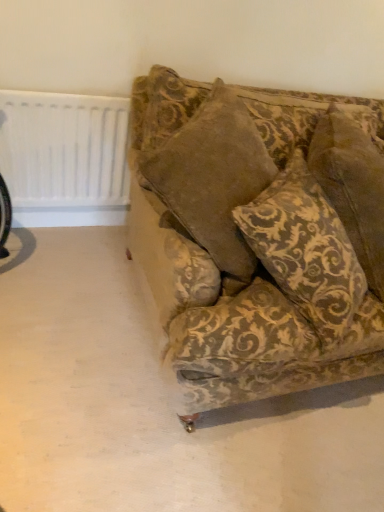
Where is `white plastic radiator at upper left`? Image resolution: width=384 pixels, height=512 pixels. white plastic radiator at upper left is located at coordinates (64, 149).

This screenshot has height=512, width=384. Find the location of `velvet gold-patterned pillow at center`. velvet gold-patterned pillow at center is located at coordinates (305, 249).

I want to click on velvet-patterned couch at center, so click(x=258, y=237).

Where is `pillow on the right of velvet-patterned couch at center`? The height and width of the screenshot is (512, 384). pillow on the right of velvet-patterned couch at center is located at coordinates (305, 249).

Is velvet-patterned couch at center looking in the opposite direction of velvet gold-patterned pillow at center?

Yes, velvet gold-patterned pillow at center is at the back of velvet-patterned couch at center.

Does velvet-patterned couch at center lie in front of velvet gold-patterned pillow at center?

Yes, it is in front of velvet gold-patterned pillow at center.

This screenshot has height=512, width=384. Find the location of `studio couch lying on the left of velvet gold-patterned pillow at center`. studio couch lying on the left of velvet gold-patterned pillow at center is located at coordinates (258, 237).

Between velvet gold-patterned pillow at center and velvet-patterned couch at center, which one has smaller size?

velvet-patterned couch at center is smaller.

Is point (267, 258) closer or farther from the camera than point (270, 381)?

Point (267, 258) is positioned closer to the camera compared to point (270, 381).

Looking at their sizes, would you say velvet gold-patterned pillow at center is wider or thinner than velvet-patterned couch at center?

Clearly, velvet gold-patterned pillow at center has more width compared to velvet-patterned couch at center.

Locate an element on the screen. The height and width of the screenshot is (512, 384). radiator located underneath the velvet-patterned couch at center (from a real-world perspective) is located at coordinates (64, 149).

Is white plastic radiator at upper left at the right side of velvet-patterned couch at center?

No, white plastic radiator at upper left is not to the right of velvet-patterned couch at center.

Based on the photo, from the image's perspective, between white plastic radiator at upper left and velvet-patterned couch at center, which one is located above?

white plastic radiator at upper left is shown above in the image.

Is white plastic radiator at upper left next to velvet-patterned couch at center and touching it?

No, white plastic radiator at upper left is not making contact with velvet-patterned couch at center.

Is velvet gold-patterned pillow at center to the left of white plastic radiator at upper left from the viewer's perspective?

No, velvet gold-patterned pillow at center is not to the left of white plastic radiator at upper left.

Can you confirm if velvet gold-patterned pillow at center is bigger than white plastic radiator at upper left?

Indeed, velvet gold-patterned pillow at center has a larger size compared to white plastic radiator at upper left.

In order to click on pillow lying below the white plastic radiator at upper left (from the image's perspective) in this screenshot , I will do (305, 249).

Can you confirm if velvet-patterned couch at center is positioned to the right of white plastic radiator at upper left?

Yes.

You are a GUI agent. You are given a task and a screenshot of the screen. Output one action in this format:
    pyautogui.click(x=<x>, y=<y>)
    Task: Click on the radiator on the left of velvet-patterned couch at center
    
    Given the screenshot: What is the action you would take?
    pyautogui.click(x=64, y=149)

Considering the sizes of objects velvet-patterned couch at center and white plastic radiator at upper left in the image provided, who is taller, velvet-patterned couch at center or white plastic radiator at upper left?

velvet-patterned couch at center is taller.

Looking at this image, is velvet gold-patterned pillow at center inside white plastic radiator at upper left?

No, velvet gold-patterned pillow at center is located outside of white plastic radiator at upper left.

Considering the relative positions of white plastic radiator at upper left and velvet gold-patterned pillow at center in the image provided, is white plastic radiator at upper left to the right of velvet gold-patterned pillow at center from the viewer's perspective?

No.

Is white plastic radiator at upper left not near velvet gold-patterned pillow at center?

No, white plastic radiator at upper left is not far away from velvet gold-patterned pillow at center.

From the image's perspective, is white plastic radiator at upper left beneath velvet gold-patterned pillow at center?

No.

At what (x,y) coordinates should I click in order to perform the action: click on pillow behind the velvet-patterned couch at center. Please return your answer as a coordinate pair (x, y). The width and height of the screenshot is (384, 512). Looking at the image, I should click on (305, 249).

This screenshot has width=384, height=512. What are the coordinates of `pillow to the right of velvet-patterned couch at center` in the screenshot? It's located at (305, 249).

Looking at the image, which one is located closer to velvet-patterned couch at center, velvet gold-patterned pillow at center or white plastic radiator at upper left?

velvet gold-patterned pillow at center lies closer to velvet-patterned couch at center than the other object.

Which object lies further to the anchor point velvet-patterned couch at center, white plastic radiator at upper left or velvet gold-patterned pillow at center?

The object further to velvet-patterned couch at center is white plastic radiator at upper left.

From the image, which object appears to be farther from white plastic radiator at upper left, velvet gold-patterned pillow at center or velvet-patterned couch at center?

velvet gold-patterned pillow at center.

Estimate the real-world distances between objects in this image. Which object is further from white plastic radiator at upper left, velvet-patterned couch at center or velvet gold-patterned pillow at center?

velvet gold-patterned pillow at center is positioned further to the anchor white plastic radiator at upper left.

When comparing their distances from velvet gold-patterned pillow at center, does velvet-patterned couch at center or white plastic radiator at upper left seem further?

white plastic radiator at upper left.

Based on their spatial positions, is white plastic radiator at upper left or velvet-patterned couch at center closer to velvet gold-patterned pillow at center?

velvet-patterned couch at center.

In order to click on studio couch between white plastic radiator at upper left and velvet gold-patterned pillow at center in the horizontal direction in this screenshot , I will do `click(258, 237)`.